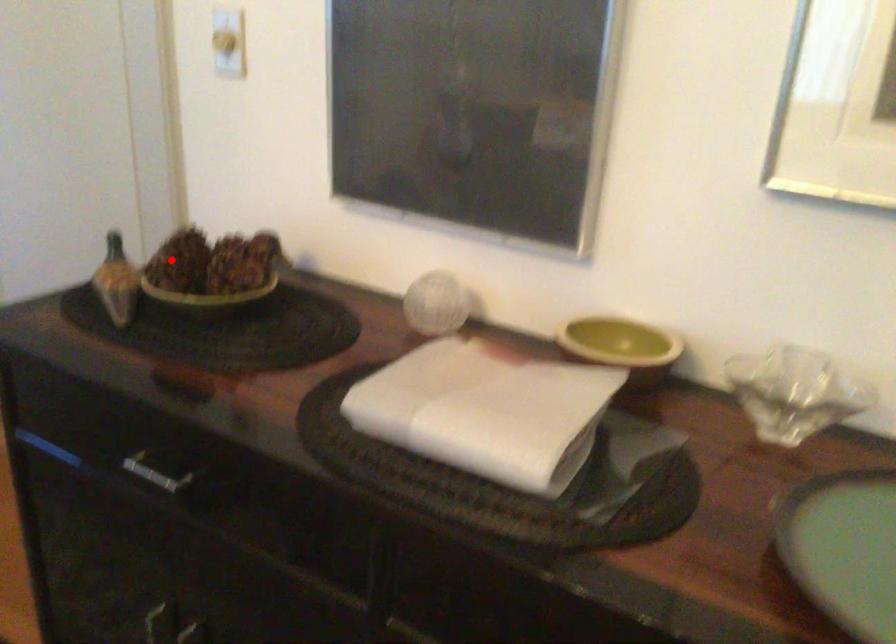
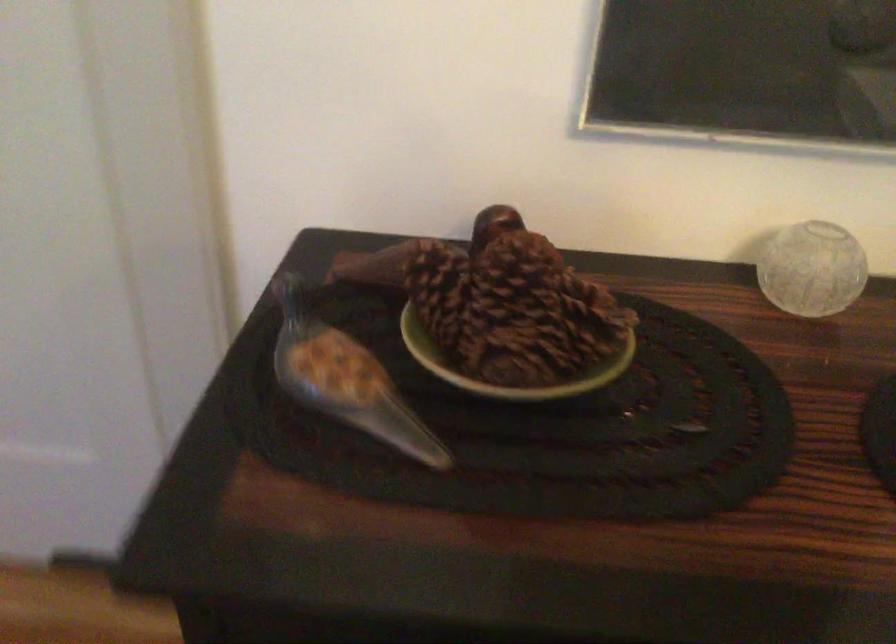
In the second image, find the point that corresponds to the highlighted location in the first image.

(440, 292)